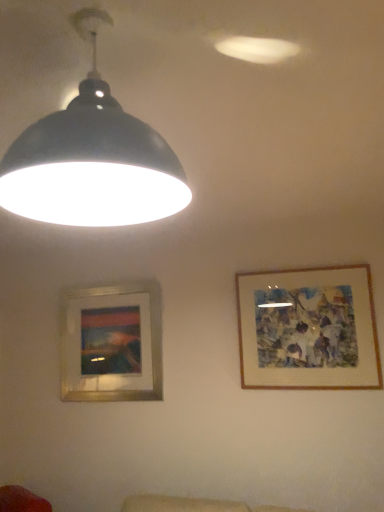
Question: Is silver metallic picture frame at lower left, which ranks as the second picture frame in right-to-left order, situated inside matte black lampshade at upper left or outside?

Choices:
 (A) inside
 (B) outside

Answer: (B)

Question: Looking at their shapes, would you say silver metallic picture frame at lower left, arranged as the 2th picture frame when viewed from the front, is wider or thinner than matte black lampshade at upper left?

Choices:
 (A) thin
 (B) wide

Answer: (A)

Question: Considering the real-world distances, which object is closest to the matte black lampshade at upper left?

Choices:
 (A) wooden-framed artwork at upper right, which appears as the second picture frame when viewed from the left
 (B) silver metallic picture frame at lower left, the first picture frame viewed from the left

Answer: (A)

Question: Considering the real-world distances, which object is closest to the matte black lampshade at upper left?

Choices:
 (A) wooden-framed artwork at upper right, acting as the 2th picture frame starting from the back
 (B) silver metallic picture frame at lower left, which ranks as the second picture frame in right-to-left order

Answer: (A)